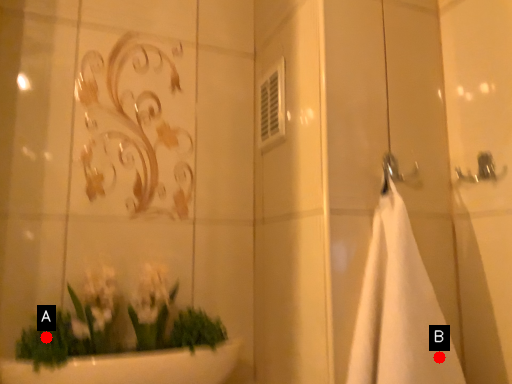
Question: Two points are circled on the image, labeled by A and B beside each circle. Which point appears farthest from the camera in this image?

Choices:
 (A) A is further
 (B) B is further

Answer: (A)